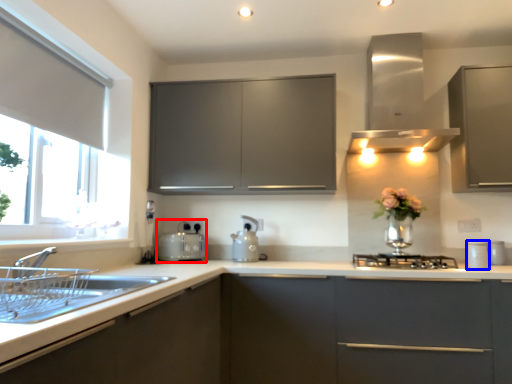
Question: Which point is further to the camera, appliance (highlighted by a red box) or appliance (highlighted by a blue box)?

Choices:
 (A) appliance
 (B) appliance

Answer: (A)